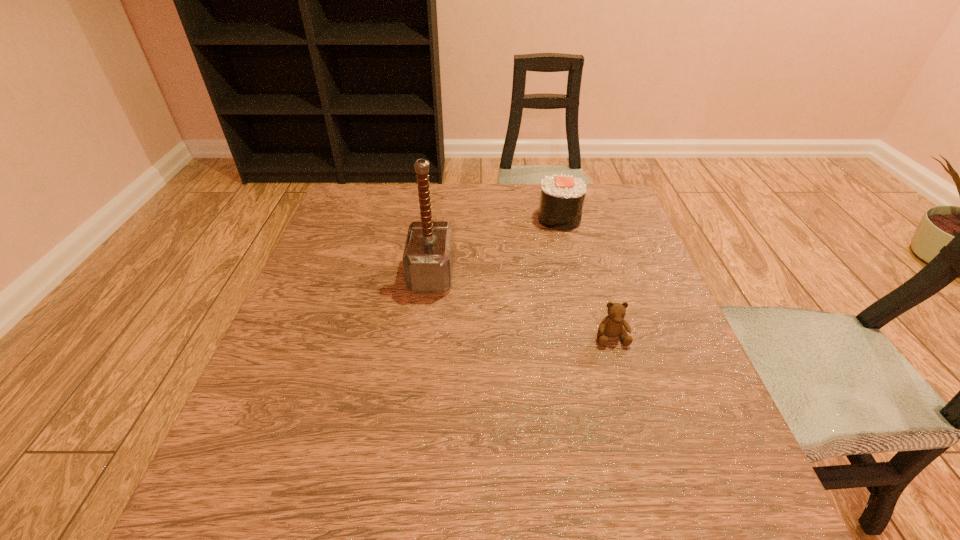
In order to click on vacant space that satisfies the following two spatial constraints: 1. on the back side of the leftmost object; 2. on the right side of the second shortest object in this screenshot , I will do `click(439, 218)`.

Find the location of a particular element. Image resolution: width=960 pixels, height=540 pixels. free spot that satisfies the following two spatial constraints: 1. on the back side of the second tallest object; 2. on the right side of the tallest object is located at coordinates (439, 218).